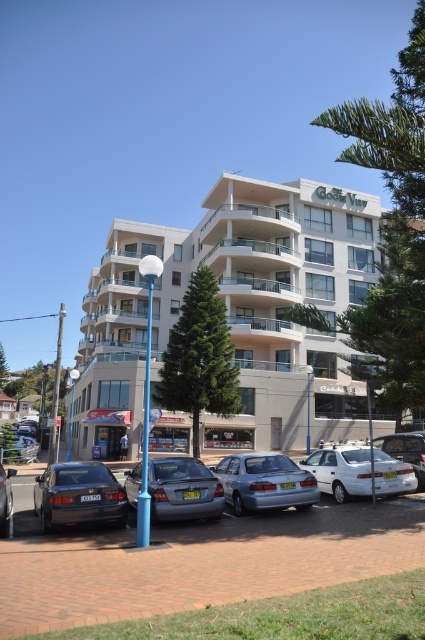
Based on the photo, you are standing in front of the Coogee View building and want to park your car. You see a satin silver sedan at center and a metallic blue sedan at center. Which car is closer to you?

The satin silver sedan at center is closer to you because it is positioned further to the viewer than the metallic blue sedan at center.

You are standing at the entrance of Coogee View and want to park your car in the parking area. There is a blue lamppost nearby. Can you tell me the color of the car located at the coordinates point (265,481)?

The point (265,481) marks the satin silver sedan at center, so the car at those coordinates is satin silver in color.

You are a delivery driver who needs to park your 2.5 meter wide truck between the satin silver sedan at center and the silver metallic sedan at center. Can your truck fit in the space between them?

The satin silver sedan at center and the silver metallic sedan at center are 3.60 meters apart. Since your truck is 2.5 meters wide, there is enough space to park between them as 3.60 meters is greater than 2.5 meters.